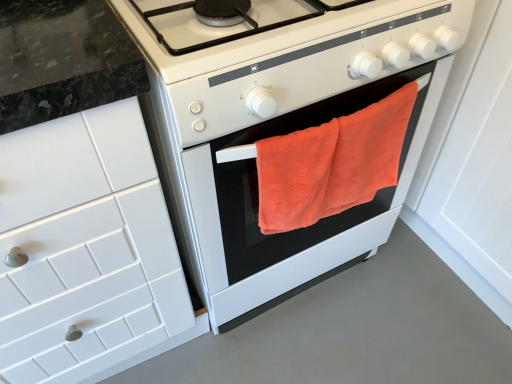
Question: Is point (386, 137) closer or farther from the camera than point (16, 140)?

Choices:
 (A) farther
 (B) closer

Answer: (A)

Question: Considering the positions of orange terry cloth towel at center and white tile cabinet at left in the image, is orange terry cloth towel at center taller or shorter than white tile cabinet at left?

Choices:
 (A) short
 (B) tall

Answer: (A)

Question: Which of these objects is positioned closest to the white tile cabinet at left?

Choices:
 (A) orange towel at center
 (B) orange terry cloth towel at center

Answer: (A)

Question: Which object is the closest to the orange towel at center?

Choices:
 (A) white tile cabinet at left
 (B) orange terry cloth towel at center

Answer: (B)